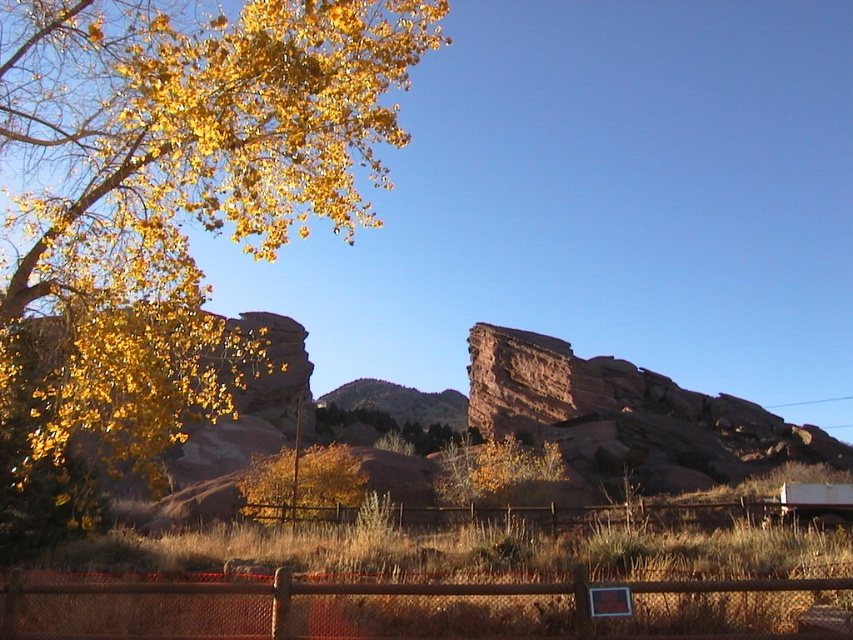
Question: Does golden leafy tree at upper left appear over rusty chain-link fence at lower center?

Choices:
 (A) yes
 (B) no

Answer: (A)

Question: Is rustic brown rock at center bigger than golden leafy tree at center?

Choices:
 (A) no
 (B) yes

Answer: (B)

Question: Which of the following is the farthest from the observer?

Choices:
 (A) rustic brown rock at center
 (B) brown wooden fence at center

Answer: (A)

Question: Which object is farther from the camera taking this photo?

Choices:
 (A) golden leafy tree at upper left
 (B) golden leafy tree at center

Answer: (B)

Question: Estimate the real-world distances between objects in this image. Which object is farther from the rusty chain-link fence at lower center?

Choices:
 (A) golden leafy tree at center
 (B) brown wooden fence at center
 (C) rustic brown rock at center
 (D) golden leafy tree at upper left

Answer: (C)

Question: Can you confirm if golden leafy tree at upper left is positioned above golden leafy tree at center?

Choices:
 (A) yes
 (B) no

Answer: (A)